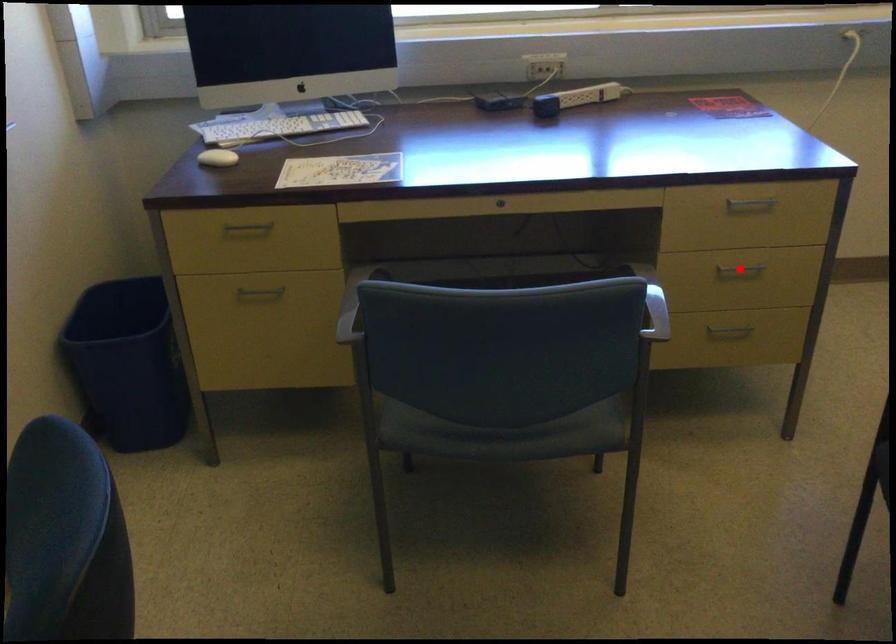
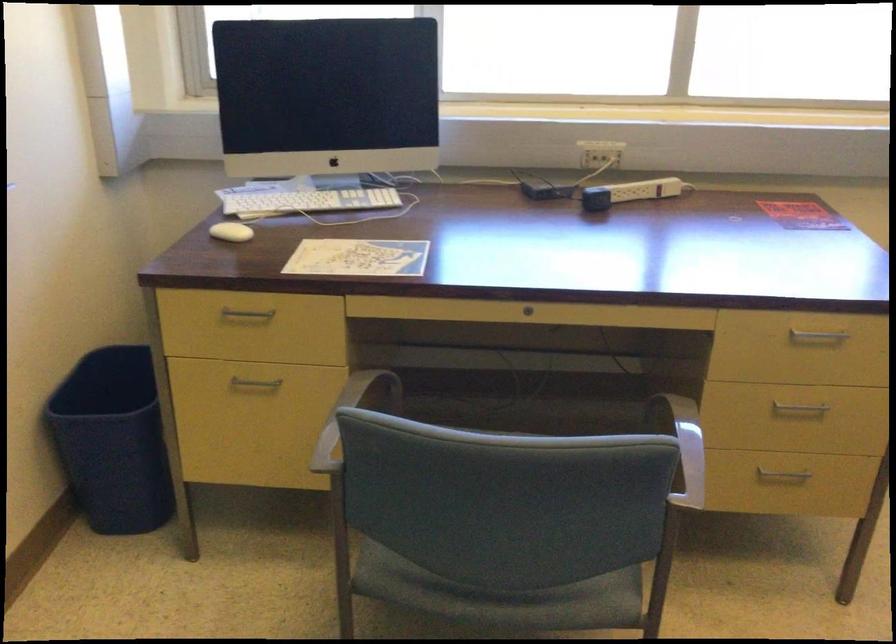
Question: I am providing you with two images of the same scene from different viewpoints. Image1 has a red point marked. In image2, the corresponding 3D location appears at what relative position? Reply with the corresponding letter.

Choices:
 (A) Closer
 (B) Farther

Answer: (A)